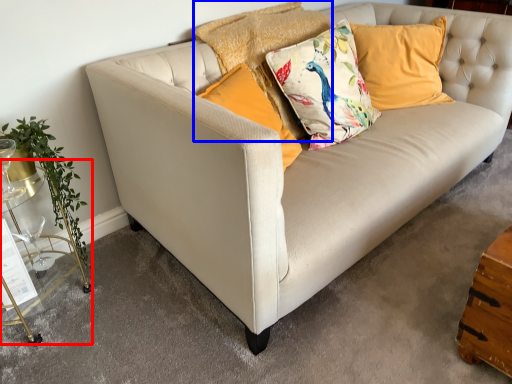
Question: Which point is further to the camera, table (highlighted by a red box) or pillow (highlighted by a blue box)?

Choices:
 (A) table
 (B) pillow

Answer: (B)